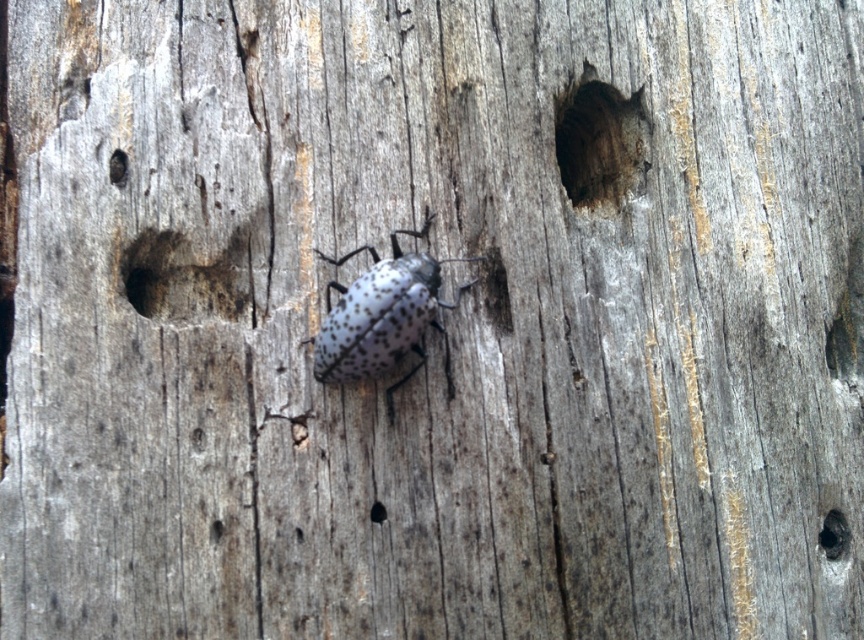
Question: Which point appears closest to the camera in this image?

Choices:
 (A) (557, 115)
 (B) (442, 300)
 (C) (843, 524)

Answer: (B)

Question: Is speckled matte beetle at center further to camera compared to dark wood hole at lower right?

Choices:
 (A) yes
 (B) no

Answer: (B)

Question: Which object is the farthest from the dark wood hole at lower right?

Choices:
 (A) dark wood hole at upper center
 (B) speckled matte beetle at center

Answer: (B)

Question: Is speckled matte beetle at center further to camera compared to dark wood hole at lower right?

Choices:
 (A) yes
 (B) no

Answer: (B)

Question: Estimate the real-world distances between objects in this image. Which object is closer to the speckled matte beetle at center?

Choices:
 (A) dark wood hole at upper center
 (B) dark wood hole at lower right

Answer: (A)

Question: Is dark wood hole at upper center below dark wood hole at lower right?

Choices:
 (A) yes
 (B) no

Answer: (B)